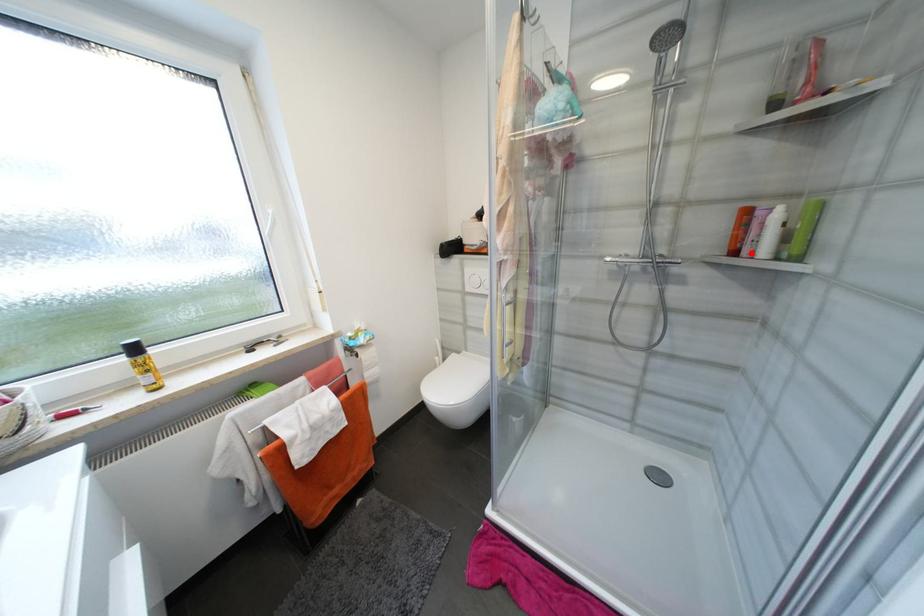
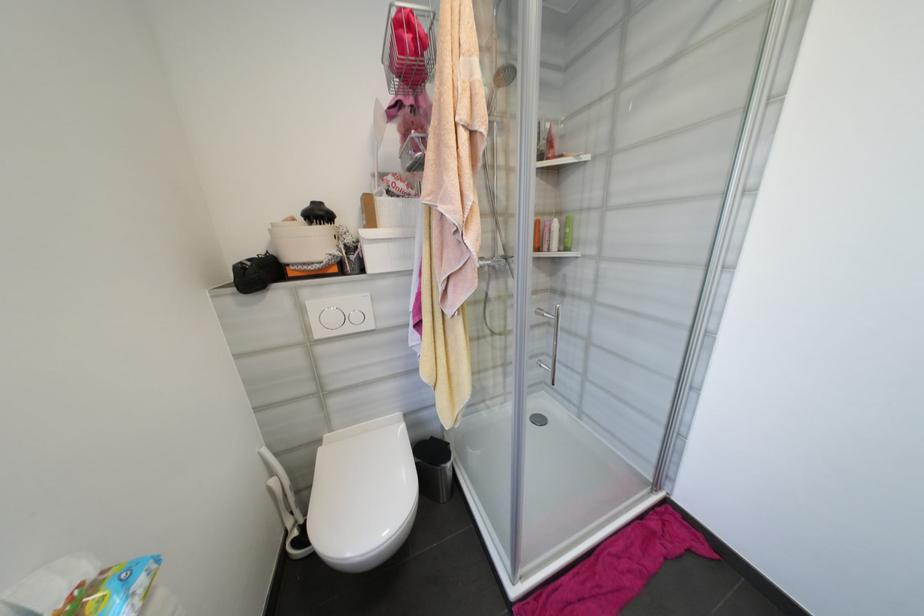
In the second image, find the point that corresponds to the highlighted location in the first image.

(551, 249)